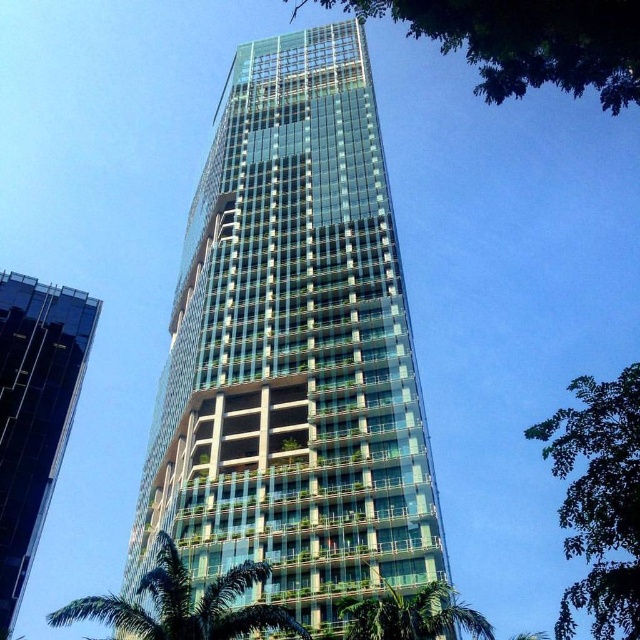
Question: Which point appears farthest from the camera in this image?

Choices:
 (A) (545, 438)
 (B) (403, 618)
 (C) (262, 625)

Answer: (A)

Question: Which object is farther from the camera taking this photo?

Choices:
 (A) green leafy tree at upper center
 (B) green leafy palm tree at lower center
 (C) green leafy tree at upper right
 (D) transparent glass building at left

Answer: (D)

Question: Which of the following is the closest to the observer?

Choices:
 (A) green leafy tree at upper right
 (B) green leafy palm tree at lower left

Answer: (A)

Question: Is transparent glass building at center closer to the viewer compared to green leafy palm tree at lower center?

Choices:
 (A) no
 (B) yes

Answer: (A)

Question: Does transparent glass building at center appear under green leafy palm tree at lower center?

Choices:
 (A) yes
 (B) no

Answer: (B)

Question: Is transparent glass building at center in front of green leafy palm tree at lower left?

Choices:
 (A) yes
 (B) no

Answer: (B)